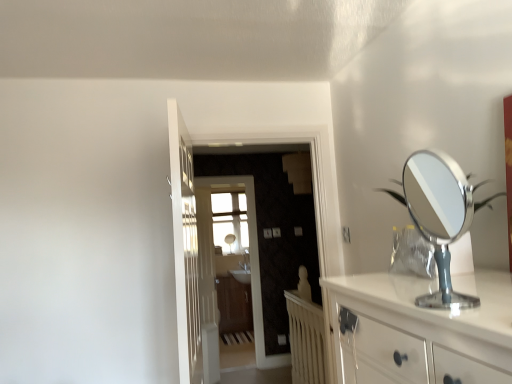
Question: Considering the relative sizes of white wooden radiator at center and matte wood screen door at center, the first screen door in the front-to-back sequence, in the image provided, is white wooden radiator at center wider than matte wood screen door at center, the first screen door in the front-to-back sequence,?

Choices:
 (A) yes
 (B) no

Answer: (B)

Question: From a real-world perspective, is white wooden radiator at center located higher than matte wood screen door at center, the first screen door in the front-to-back sequence?

Choices:
 (A) yes
 (B) no

Answer: (B)

Question: Is white wooden radiator at center at the left side of matte wood screen door at center, positioned as the 2th screen door in back-to-front order?

Choices:
 (A) yes
 (B) no

Answer: (B)

Question: Is white wooden radiator at center looking in the opposite direction of matte wood screen door at center, the first screen door in the front-to-back sequence?

Choices:
 (A) yes
 (B) no

Answer: (B)

Question: Considering the relative sizes of white wooden radiator at center and matte wood screen door at center, positioned as the 2th screen door in back-to-front order, in the image provided, is white wooden radiator at center thinner than matte wood screen door at center, positioned as the 2th screen door in back-to-front order,?

Choices:
 (A) yes
 (B) no

Answer: (A)

Question: Does white wooden radiator at center appear on the right side of matte wood screen door at center, the first screen door in the front-to-back sequence?

Choices:
 (A) yes
 (B) no

Answer: (A)

Question: Is white wooden door at center, the second door in the front-to-back sequence, further to camera compared to matte wood screen door at center, positioned as the 2th screen door in back-to-front order?

Choices:
 (A) no
 (B) yes

Answer: (B)

Question: From a real-world perspective, is white wooden door at center, the first door positioned from the left, under matte wood screen door at center, positioned as the 2th screen door in back-to-front order?

Choices:
 (A) no
 (B) yes

Answer: (B)

Question: Is white wooden door at center, which is counted as the first door, starting from the back, in contact with matte wood screen door at center, positioned as the 2th screen door in back-to-front order?

Choices:
 (A) yes
 (B) no

Answer: (B)

Question: Does white wooden door at center, the first door positioned from the left, have a larger size compared to matte wood screen door at center, positioned as the 2th screen door in back-to-front order?

Choices:
 (A) no
 (B) yes

Answer: (A)

Question: Considering the relative sizes of white wooden door at center, which is counted as the first door, starting from the back, and matte wood screen door at center, the first screen door in the front-to-back sequence, in the image provided, is white wooden door at center, which is counted as the first door, starting from the back, thinner than matte wood screen door at center, the first screen door in the front-to-back sequence,?

Choices:
 (A) yes
 (B) no

Answer: (A)

Question: Is white wooden door at center, arranged as the 2th door when viewed from the right, positioned in front of matte wood screen door at center, positioned as the 2th screen door in back-to-front order?

Choices:
 (A) no
 (B) yes

Answer: (A)

Question: Can you confirm if wooden cabinet at center is wider than white wooden radiator at center?

Choices:
 (A) yes
 (B) no

Answer: (A)